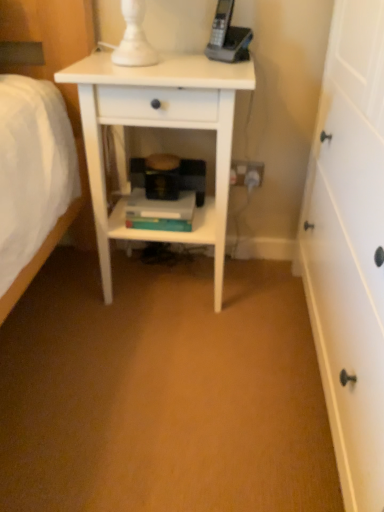
This screenshot has height=512, width=384. Find the location of `free space above hardcover books at center (from a real-world perspective)`. free space above hardcover books at center (from a real-world perspective) is located at coordinates (158, 199).